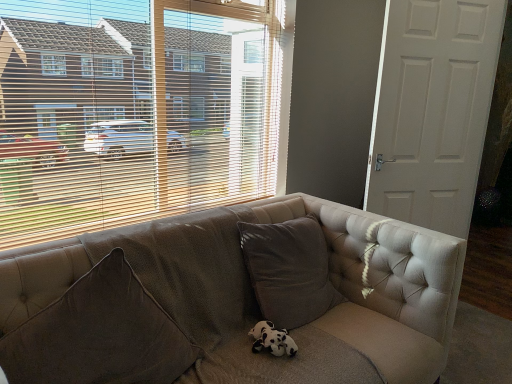
Question: Considering the relative sizes of tufted fabric couch at center and wooden blinds at upper left in the image provided, is tufted fabric couch at center smaller than wooden blinds at upper left?

Choices:
 (A) no
 (B) yes

Answer: (A)

Question: Is tufted fabric couch at center next to wooden blinds at upper left?

Choices:
 (A) yes
 (B) no

Answer: (B)

Question: Considering the relative sizes of tufted fabric couch at center and wooden blinds at upper left in the image provided, is tufted fabric couch at center wider than wooden blinds at upper left?

Choices:
 (A) yes
 (B) no

Answer: (A)

Question: Can you confirm if tufted fabric couch at center is thinner than wooden blinds at upper left?

Choices:
 (A) no
 (B) yes

Answer: (A)

Question: Is tufted fabric couch at center to the left of wooden blinds at upper left from the viewer's perspective?

Choices:
 (A) yes
 (B) no

Answer: (B)

Question: Is white matte door at right wider or thinner than brown textured pillow at lower left?

Choices:
 (A) wide
 (B) thin

Answer: (B)

Question: From a real-world perspective, is white matte door at right physically located above or below brown textured pillow at lower left?

Choices:
 (A) above
 (B) below

Answer: (A)

Question: Is white matte door at right in front of or behind brown textured pillow at lower left in the image?

Choices:
 (A) front
 (B) behind

Answer: (B)

Question: Is white matte door at right spatially inside brown textured pillow at lower left, or outside of it?

Choices:
 (A) outside
 (B) inside

Answer: (A)

Question: From the image's perspective, relative to tufted fabric couch at center, is black and white plush at center above or below?

Choices:
 (A) below
 (B) above

Answer: (A)

Question: In the image, is black and white plush at center on the left side or the right side of tufted fabric couch at center?

Choices:
 (A) right
 (B) left

Answer: (A)

Question: Considering the positions of black and white plush at center and tufted fabric couch at center in the image, is black and white plush at center wider or thinner than tufted fabric couch at center?

Choices:
 (A) wide
 (B) thin

Answer: (B)

Question: Is black and white plush at center inside the boundaries of tufted fabric couch at center, or outside?

Choices:
 (A) inside
 (B) outside

Answer: (A)

Question: Considering the positions of brown textured pillow at lower left and tufted fabric couch at center in the image, is brown textured pillow at lower left wider or thinner than tufted fabric couch at center?

Choices:
 (A) wide
 (B) thin

Answer: (B)

Question: Based on their sizes in the image, would you say brown textured pillow at lower left is bigger or smaller than tufted fabric couch at center?

Choices:
 (A) small
 (B) big

Answer: (A)